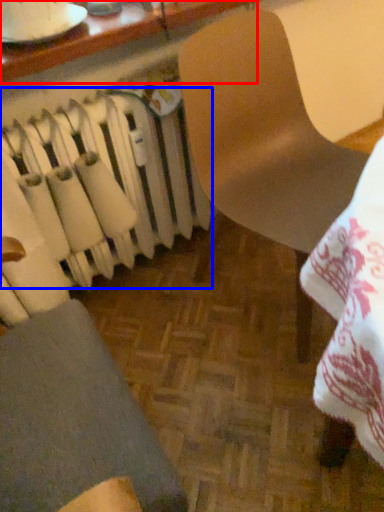
Question: Among these objects, which one is farthest to the camera, table (highlighted by a red box) or radiator (highlighted by a blue box)?

Choices:
 (A) table
 (B) radiator

Answer: (B)